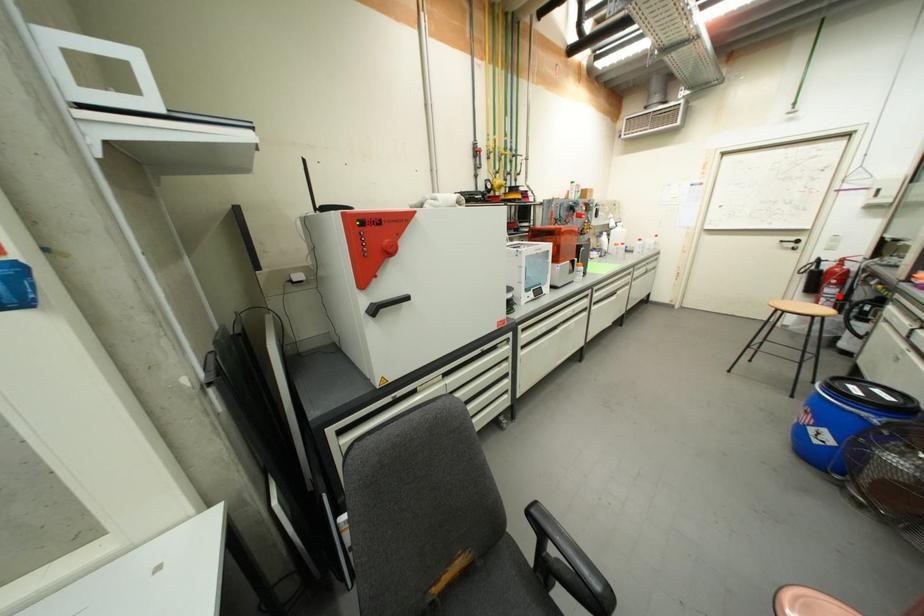
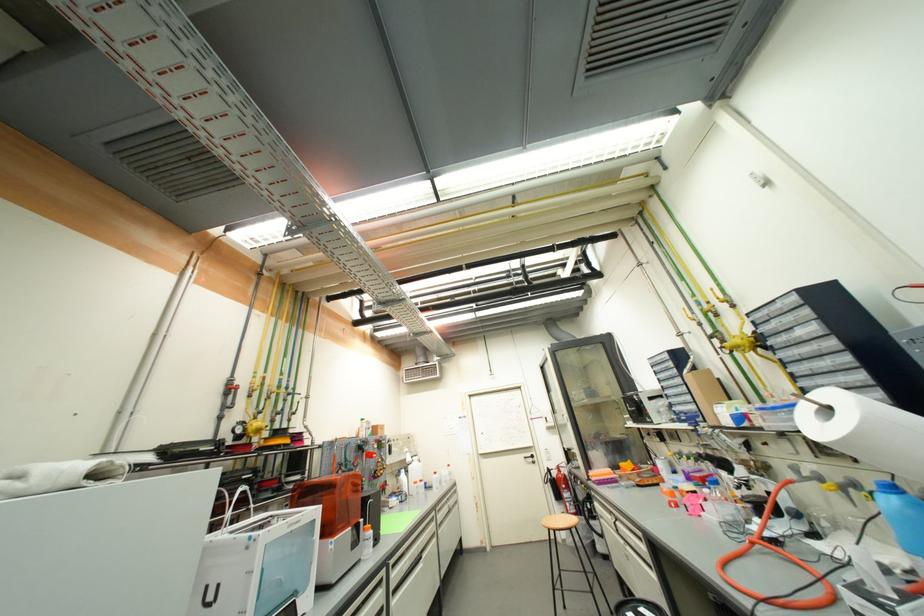
Find the pixel in the second image that matches the highlighted location in the first image.

(575, 500)